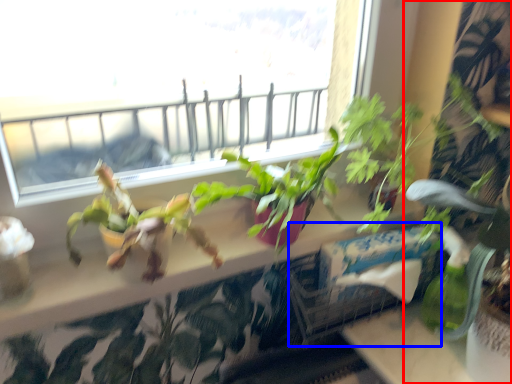
Question: Which object is closer to the camera taking this photo, houseplant (highlighted by a red box) or window box (highlighted by a blue box)?

Choices:
 (A) houseplant
 (B) window box

Answer: (A)